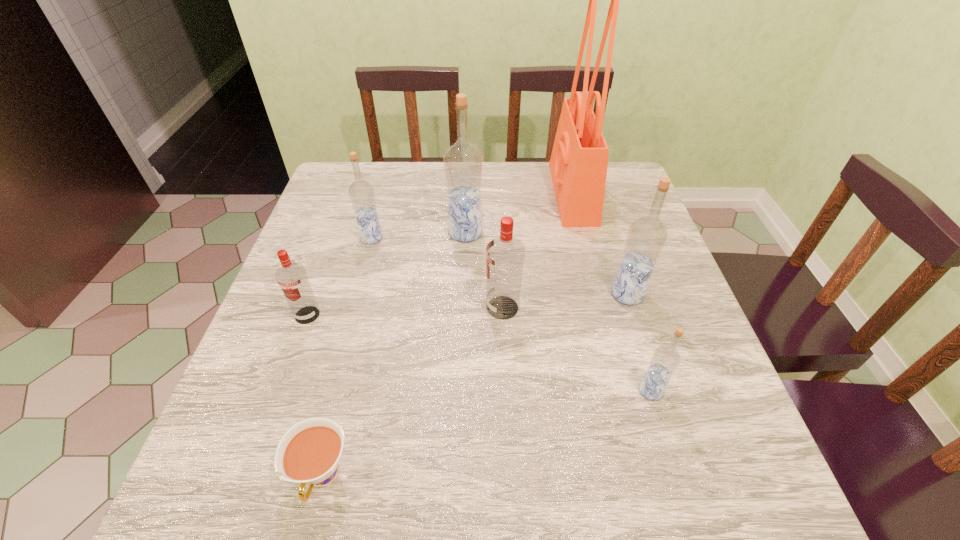
The height and width of the screenshot is (540, 960). I want to click on vacant space located on the front of the third biggest blue vodka, so click(x=334, y=376).

Locate an element on the screen. vacant space situated on the front label of the third vodka from right to left is located at coordinates (458, 308).

In order to click on blank area located on the front label of the third vodka from right to left in this screenshot , I will do click(x=458, y=308).

You are a GUI agent. You are given a task and a screenshot of the screen. Output one action in this format:
    pyautogui.click(x=<x>, y=<y>)
    Task: Click on the free location located 0.170m on the front label of the third vodka from right to left
    This screenshot has height=540, width=960.
    Given the screenshot: What is the action you would take?
    pyautogui.click(x=407, y=308)

This screenshot has width=960, height=540. Find the location of `vacant space located 0.250m on the front label of the left red vodka`. vacant space located 0.250m on the front label of the left red vodka is located at coordinates (262, 440).

In order to click on free region located on the left of the nearest blue vodka in this screenshot , I will do `click(579, 391)`.

At what (x,y) coordinates should I click in order to perform the action: click on object at the far edge. Please return your answer as a coordinate pair (x, y). This screenshot has height=540, width=960. Looking at the image, I should click on (579, 160).

The width and height of the screenshot is (960, 540). I want to click on object located in the near edge section of the desktop, so click(x=309, y=452).

Find the location of a particular element. The height and width of the screenshot is (540, 960). teacup located at the left edge is located at coordinates (309, 452).

Locate an element on the screen. This screenshot has height=540, width=960. tote bag that is at the right edge is located at coordinates (579, 160).